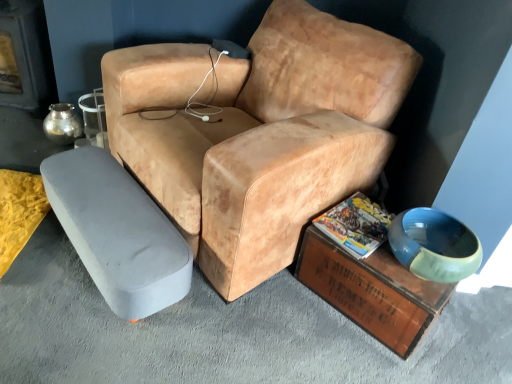
Question: Is leather-like tan chair at center next to gray fabric ottoman at lower left, which is the 2th table in right-to-left order, and touching it?

Choices:
 (A) no
 (B) yes

Answer: (A)

Question: Considering the relative sizes of leather-like tan chair at center and gray fabric ottoman at lower left, which is the 2th table in right-to-left order, in the image provided, is leather-like tan chair at center smaller than gray fabric ottoman at lower left, which is the 2th table in right-to-left order,?

Choices:
 (A) yes
 (B) no

Answer: (B)

Question: Does leather-like tan chair at center have a lesser height compared to gray fabric ottoman at lower left, which is the 2th table in right-to-left order?

Choices:
 (A) no
 (B) yes

Answer: (A)

Question: Does leather-like tan chair at center appear on the left side of gray fabric ottoman at lower left, acting as the first table starting from the left?

Choices:
 (A) no
 (B) yes

Answer: (A)

Question: From a real-world perspective, is leather-like tan chair at center on top of gray fabric ottoman at lower left, which is the 2th table in right-to-left order?

Choices:
 (A) yes
 (B) no

Answer: (A)

Question: From the image's perspective, is gray fabric ottoman at lower left, which is the 2th table in right-to-left order, above or below matte paper magazine at lower right?

Choices:
 (A) below
 (B) above

Answer: (A)

Question: Which is correct: gray fabric ottoman at lower left, acting as the first table starting from the left, is inside matte paper magazine at lower right, or outside of it?

Choices:
 (A) inside
 (B) outside

Answer: (B)

Question: In terms of height, does gray fabric ottoman at lower left, which is the 2th table in right-to-left order, look taller or shorter compared to matte paper magazine at lower right?

Choices:
 (A) short
 (B) tall

Answer: (B)

Question: Considering the relative positions of gray fabric ottoman at lower left, acting as the first table starting from the left, and matte paper magazine at lower right in the image provided, is gray fabric ottoman at lower left, acting as the first table starting from the left, to the left or to the right of matte paper magazine at lower right?

Choices:
 (A) left
 (B) right

Answer: (A)

Question: In terms of width, does metallic silver fireplace at left look wider or thinner when compared to matte paper magazine at lower right?

Choices:
 (A) thin
 (B) wide

Answer: (A)

Question: From a real-world perspective, is metallic silver fireplace at left positioned above or below matte paper magazine at lower right?

Choices:
 (A) above
 (B) below

Answer: (A)

Question: Is metallic silver fireplace at left bigger or smaller than matte paper magazine at lower right?

Choices:
 (A) big
 (B) small

Answer: (A)

Question: Would you say metallic silver fireplace at left is to the left or to the right of matte paper magazine at lower right in the picture?

Choices:
 (A) left
 (B) right

Answer: (A)

Question: From a real-world perspective, is leather-like tan chair at center above or below metallic silver fireplace at left?

Choices:
 (A) above
 (B) below

Answer: (A)

Question: From their relative heights in the image, would you say leather-like tan chair at center is taller or shorter than metallic silver fireplace at left?

Choices:
 (A) tall
 (B) short

Answer: (A)